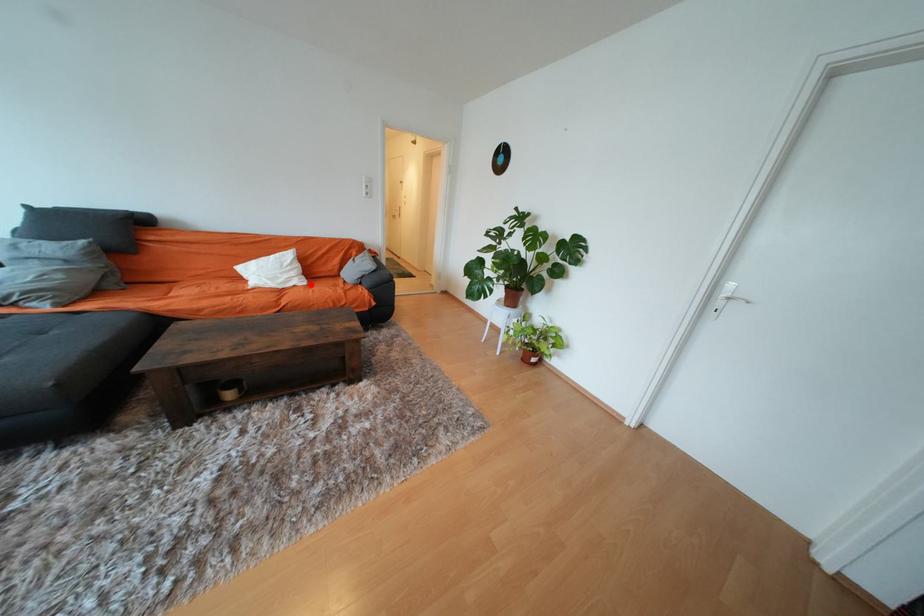
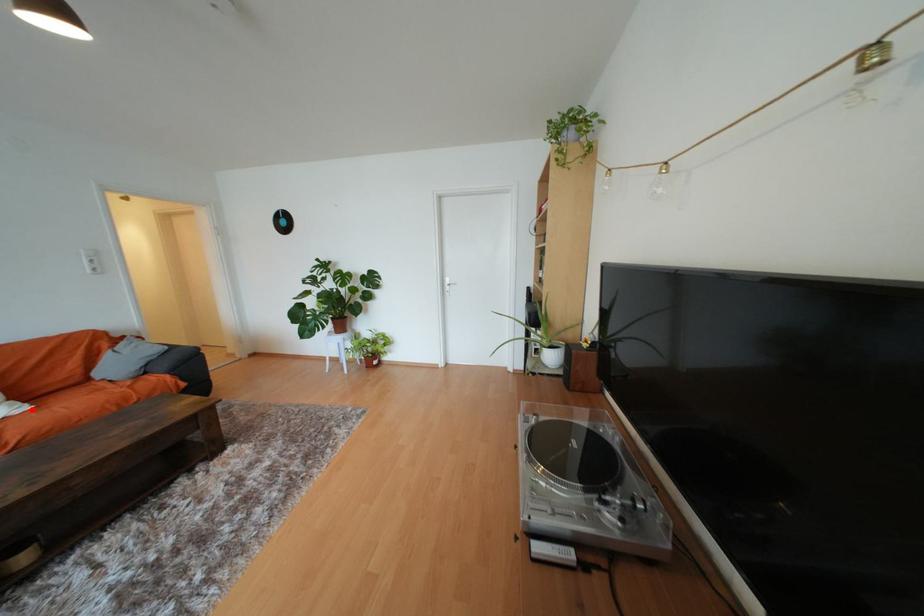
I am providing you with two images of the same scene from different viewpoints. A red point is marked on the first image and another point is marked on the second image. Are the points marked in image1 and image2 representing the same 3D position?

Yes